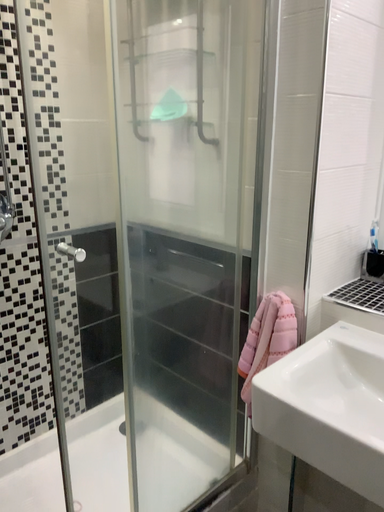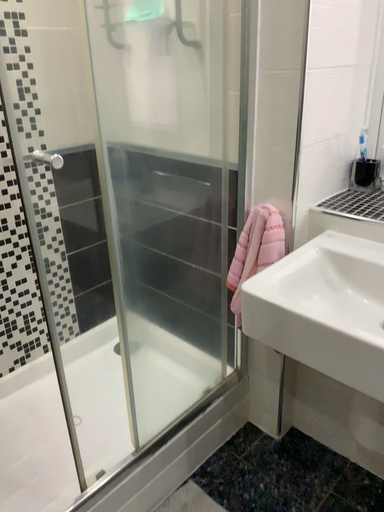
Question: How did the camera likely rotate when shooting the video?

Choices:
 (A) rotated upward
 (B) rotated downward

Answer: (B)